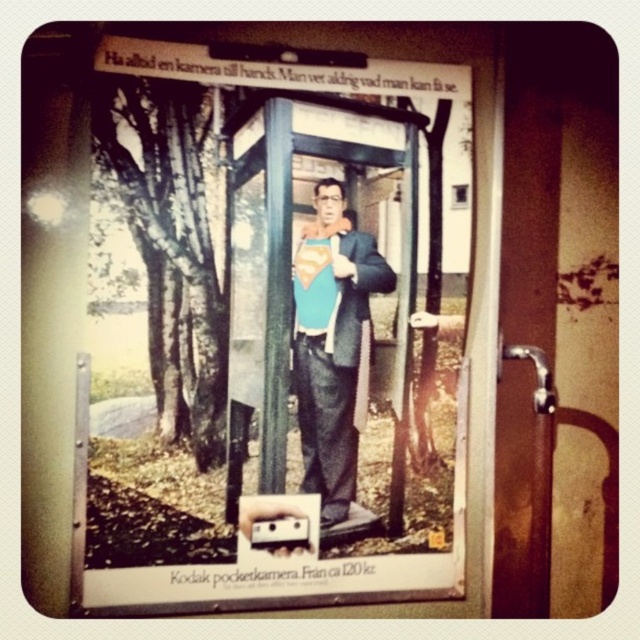
You are a tailor examining the vintage Kodak advertisement. You need to determine which part of the man in the center has a greater width between his matte blue suit at center and the blue fabric superman suit at center. Which one is wider?

The matte blue suit at center is wider than the blue fabric superman suit at center according to the description.

You are a tailor who needs to determine which piece of clothing from the image is larger to decide which requires more fabric. The image shows a man wearing a matte blue suit at center and a blue fabric superman suit at center. Which one is larger?

Result: The matte blue suit at center is bigger than the blue fabric superman suit at center, so the matte blue suit at center requires more fabric.